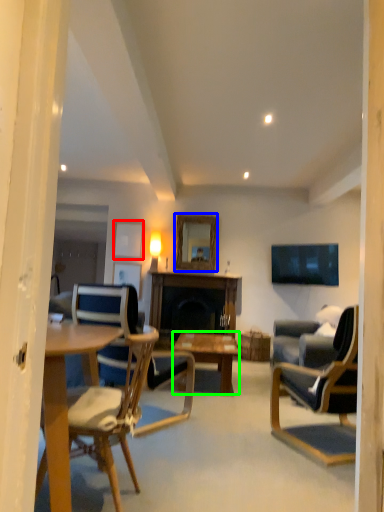
Question: Which object is the farthest from picture frame (highlighted by a red box)? Choose among these: mirror (highlighted by a blue box) or coffee table (highlighted by a green box).

Choices:
 (A) mirror
 (B) coffee table

Answer: (B)